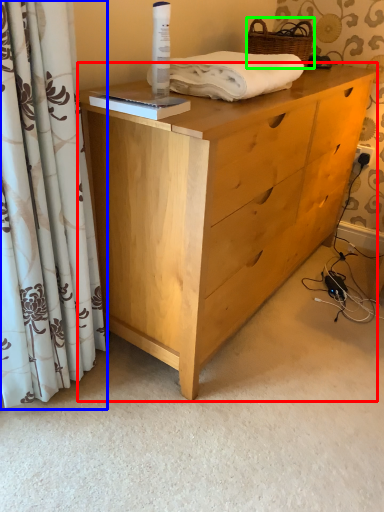
Question: Which is farther away from chest of drawers (highlighted by a red box)? curtain (highlighted by a blue box) or basket (highlighted by a green box)?

Choices:
 (A) curtain
 (B) basket

Answer: (B)